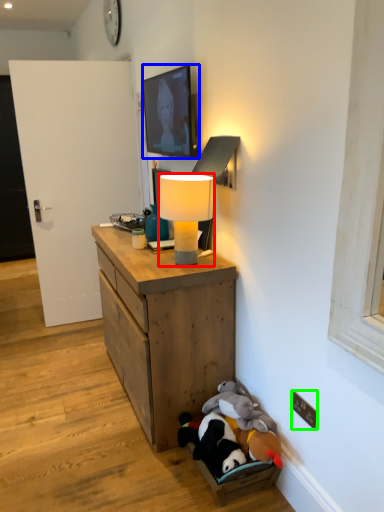
Question: Based on their relative distances, which object is farther from lamp (highlighted by a red box)? Choose from picture frame (highlighted by a blue box) and electric outlet (highlighted by a green box).

Choices:
 (A) picture frame
 (B) electric outlet

Answer: (B)